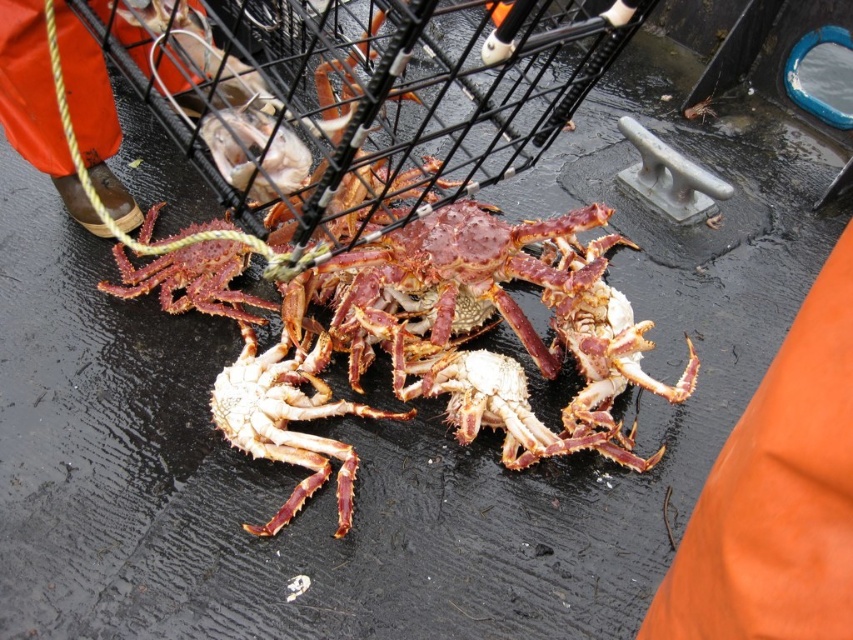
Question: Which point is farther to the camera?

Choices:
 (A) (177, 300)
 (B) (247, 364)

Answer: (A)

Question: Is shiny red crab at center further to camera compared to shiny reddish-brown crab at center?

Choices:
 (A) yes
 (B) no

Answer: (B)

Question: Does shiny red crab at center appear over shiny reddish-brown crab at center?

Choices:
 (A) no
 (B) yes

Answer: (A)

Question: Can you confirm if shiny red crab at center is positioned to the right of shiny reddish-brown crab at center?

Choices:
 (A) yes
 (B) no

Answer: (A)